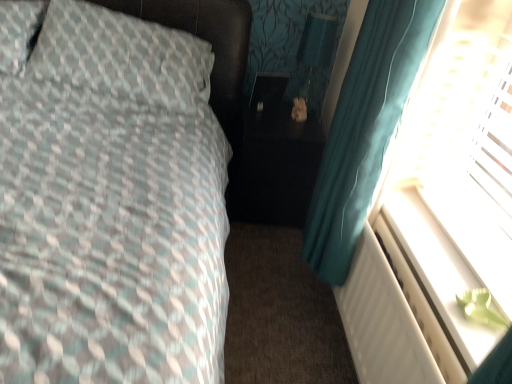
At what (x,y) coordinates should I click in order to perform the action: click on black glossy side table at center. Please return your answer as a coordinate pair (x, y). Looking at the image, I should click on (276, 167).

The image size is (512, 384). What do you see at coordinates (444, 267) in the screenshot?
I see `transparent plastic screen at right` at bounding box center [444, 267].

Identify the location of teal fabric curtain at right. The width and height of the screenshot is (512, 384). (364, 129).

Describe the element at coordinates (364, 129) in the screenshot. This screenshot has height=384, width=512. I see `teal fabric curtain at right` at that location.

The width and height of the screenshot is (512, 384). I want to click on matte black table lamp at center, so click(314, 56).

Locate an element on the screen. This screenshot has width=512, height=384. black glossy side table at center is located at coordinates (276, 167).

Can you confirm if transparent plastic screen at right is shorter than textured fabric pillow at left?

Indeed, transparent plastic screen at right has a lesser height compared to textured fabric pillow at left.

Which of these two, transparent plastic screen at right or textured fabric pillow at left, is bigger?

textured fabric pillow at left is bigger.

Is transparent plastic screen at right in front of or behind textured fabric pillow at left in the image?

Clearly, transparent plastic screen at right is in front of textured fabric pillow at left.

Which is closer to the camera, (449, 180) or (147, 79)?

Clearly, point (449, 180) is closer to the camera than point (147, 79).

Is black glossy side table at center bigger than teal fabric curtain at right?

Correct, black glossy side table at center is larger in size than teal fabric curtain at right.

Is black glossy side table at center touching teal fabric curtain at right?

They are not placed beside each other.

From the picture: How different are the orientations of black glossy side table at center and teal fabric curtain at right in degrees?

black glossy side table at center and teal fabric curtain at right are facing 92.1 degrees away from each other.

Is black glossy side table at center positioned in front of teal fabric curtain at right?

No, black glossy side table at center is further to the viewer.

Considering the relative sizes of transparent plastic screen at right and teal fabric curtain at right in the image provided, is transparent plastic screen at right wider than teal fabric curtain at right?

Yes, transparent plastic screen at right is wider than teal fabric curtain at right.

Do you think transparent plastic screen at right is within teal fabric curtain at right, or outside of it?

transparent plastic screen at right is outside teal fabric curtain at right.

Is transparent plastic screen at right not close to teal fabric curtain at right?

No.

Who is smaller, textured fabric pillow at left or matte black table lamp at center?

With smaller size is matte black table lamp at center.

How many degrees apart are the facing directions of textured fabric pillow at left and matte black table lamp at center?

The angle between the facing direction of textured fabric pillow at left and the facing direction of matte black table lamp at center is 1.31 degrees.

Is textured fabric pillow at left positioned beyond the bounds of matte black table lamp at center?

textured fabric pillow at left is positioned outside matte black table lamp at center.

Is textured fabric pillow at left directly adjacent to matte black table lamp at center?

No, textured fabric pillow at left is not touching matte black table lamp at center.

Is white plastic radiator at lower right positioned beyond the bounds of textured fabric pillow at left?

Yes, white plastic radiator at lower right is located beyond the bounds of textured fabric pillow at left.

Where is `radiator below the textured fabric pillow at left (from the image's perspective)`? radiator below the textured fabric pillow at left (from the image's perspective) is located at coordinates (387, 320).

How far apart are white plastic radiator at lower right and textured fabric pillow at left?

white plastic radiator at lower right is 1.14 meters away from textured fabric pillow at left.

Between white plastic radiator at lower right and textured fabric pillow at left, which one is positioned behind?

textured fabric pillow at left is behind.

Is point (362, 131) closer or farther from the camera than point (268, 208)?

Point (362, 131).

From a real-world perspective, is teal fabric curtain at right located beneath black glossy side table at center?

Incorrect, from a real-world perspective, teal fabric curtain at right is higher than black glossy side table at center.

Is teal fabric curtain at right not within black glossy side table at center?

teal fabric curtain at right lies outside black glossy side table at center's area.

From their relative heights in the image, would you say teal fabric curtain at right is taller or shorter than black glossy side table at center?

Considering their sizes, teal fabric curtain at right has more height than black glossy side table at center.

Does black glossy side table at center appear on the left side of textured fabric pillow at left?

No, black glossy side table at center is not to the left of textured fabric pillow at left.

Can you confirm if black glossy side table at center is bigger than textured fabric pillow at left?

Incorrect, black glossy side table at center is not larger than textured fabric pillow at left.

I want to click on side table lying behind the textured fabric pillow at left, so 276,167.

This screenshot has height=384, width=512. What are the coordinates of `pillow located on the left of transparent plastic screen at right` in the screenshot? It's located at (121, 57).

Identify the location of side table above the teal fabric curtain at right (from the image's perspective). (276, 167).

Which object lies further to the anchor point black glossy side table at center, matte black table lamp at center or white plastic radiator at lower right?

The object further to black glossy side table at center is white plastic radiator at lower right.

Estimate the real-world distances between objects in this image. Which object is closer to transparent plastic screen at right, textured fabric pillow at left or matte black table lamp at center?

The object closer to transparent plastic screen at right is matte black table lamp at center.

Based on their spatial positions, is teal fabric curtain at right or transparent plastic screen at right further from textured fabric pillow at left?

The object further to textured fabric pillow at left is transparent plastic screen at right.

Based on their spatial positions, is textured fabric pillow at left or teal fabric curtain at right closer to white plastic radiator at lower right?

Among the two, teal fabric curtain at right is located nearer to white plastic radiator at lower right.

Based on their spatial positions, is matte black table lamp at center or black glossy side table at center closer to textured fabric pillow at left?

Among the two, black glossy side table at center is located nearer to textured fabric pillow at left.

When comparing their distances from transparent plastic screen at right, does teal fabric curtain at right or white plastic radiator at lower right seem closer?

white plastic radiator at lower right is positioned closer to the anchor transparent plastic screen at right.

Looking at the image, which one is located closer to white plastic radiator at lower right, textured fabric pillow at left or transparent plastic screen at right?

transparent plastic screen at right.

Estimate the real-world distances between objects in this image. Which object is further from textured fabric pillow at left, black glossy side table at center or white plastic radiator at lower right?

The object further to textured fabric pillow at left is white plastic radiator at lower right.

Locate an element on the screen. radiator between textured fabric pillow at left and transparent plastic screen at right is located at coordinates coord(387,320).

I want to click on window screen between teal fabric curtain at right and white plastic radiator at lower right in the vertical direction, so click(x=444, y=267).

Identify the location of side table between teal fabric curtain at right and matte black table lamp at center in the front-back direction. (276, 167).

Find the location of a particular element. The height and width of the screenshot is (384, 512). curtain between white plastic radiator at lower right and matte black table lamp at center from front to back is located at coordinates (364, 129).